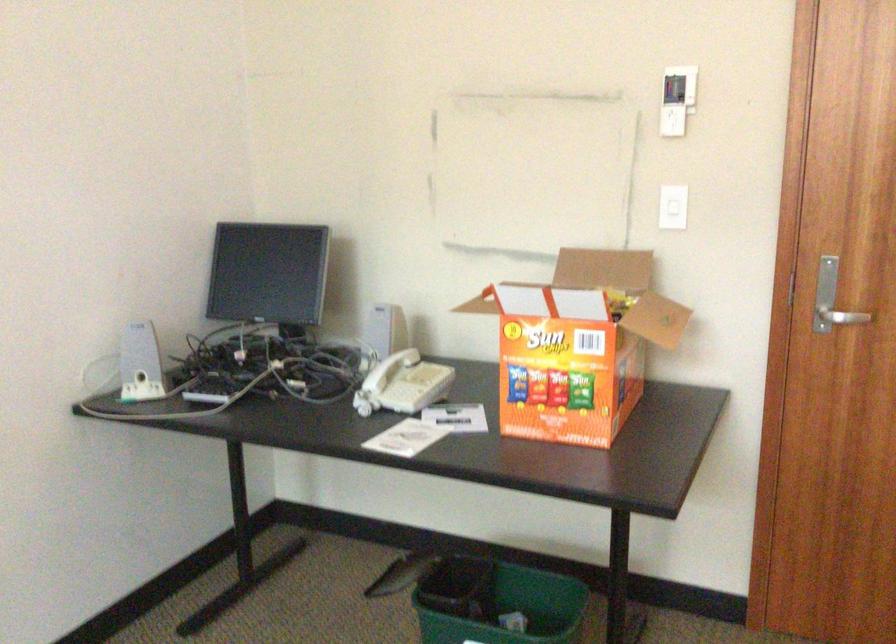
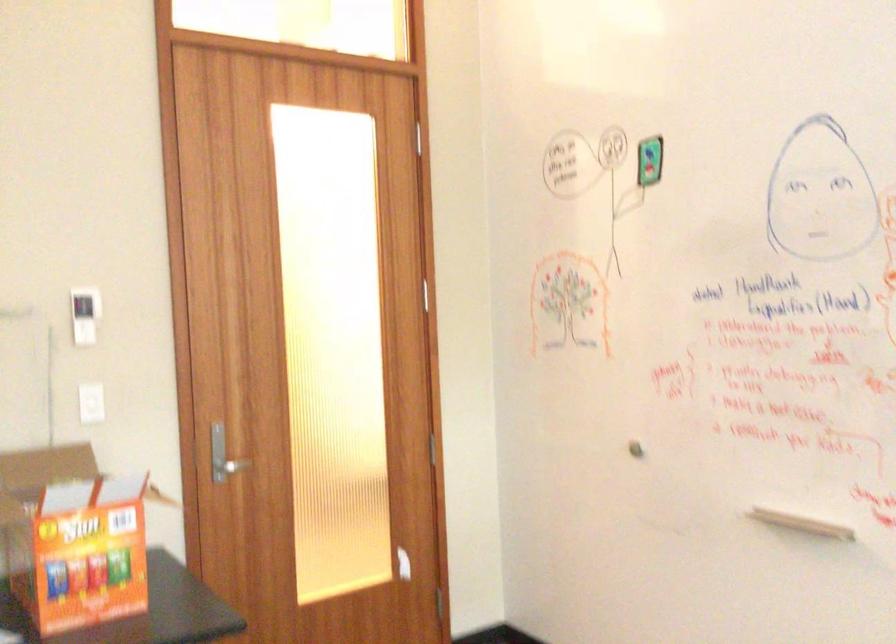
Locate, in the second image, the point that corresponds to (x=670, y=100) in the first image.

(84, 315)